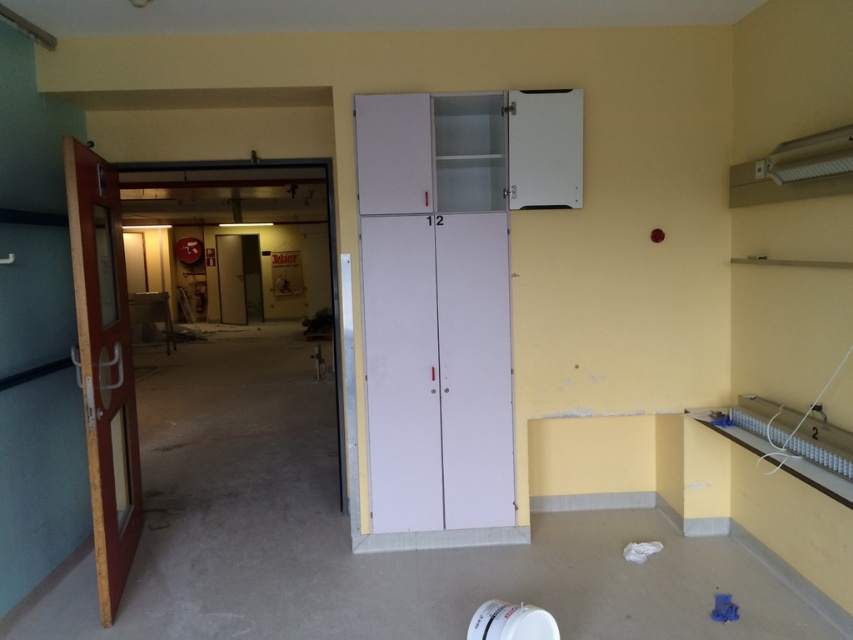
You are a construction worker who needs to move a heavy tool from the wooden glass door at left to the white matte cabinet at center. Which direction should you move the tool to place it on the cabinet?

You should move the tool to the right, as the white matte cabinet at center is located to the right of the wooden glass door at left.

You are a contractor assessing the space. The white matte cabinet at center and the wooden glass door at left need to be moved to a storage area. Which object requires more space to store?

The wooden glass door at left requires more storage space because it is larger than the white matte cabinet at center.

You are a construction worker standing at the point marked as point (437, 371) in the image. What object are you standing on?

You are standing on the white matte cabinet at center located at point (437, 371).